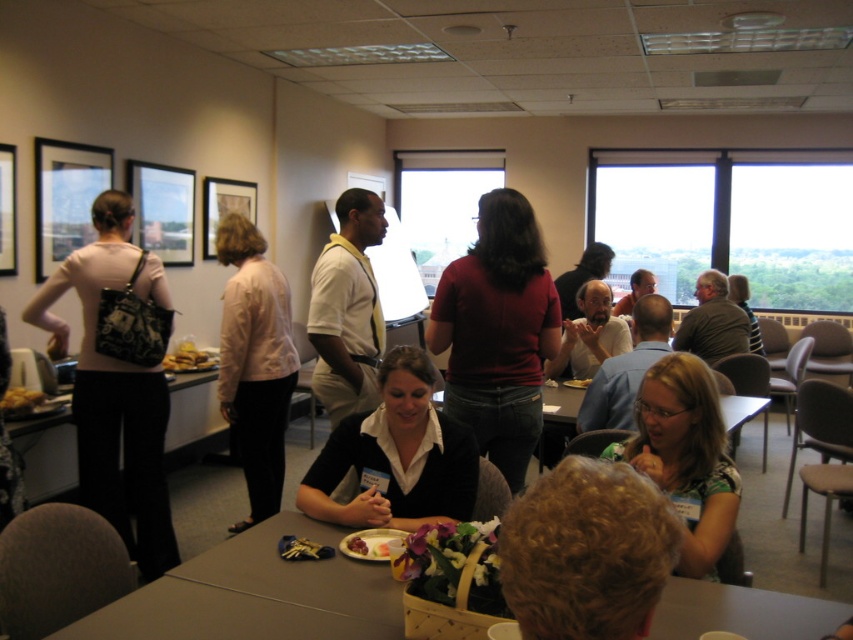
Question: Is light pink fabric shirt at center smaller than smooth white plate at center?

Choices:
 (A) yes
 (B) no

Answer: (B)

Question: Which object appears farthest from the camera in this image?

Choices:
 (A) smooth wooden table at center
 (B) matte black shirt at center

Answer: (B)

Question: Which of the following is the farthest from the observer?

Choices:
 (A) (20, 394)
 (B) (498, 371)
 (C) (169, 362)

Answer: (C)

Question: Which object is farther from the camera taking this photo?

Choices:
 (A) smooth wooden table at center
 (B) matte green shirt at center

Answer: (B)

Question: Observing the image, what is the correct spatial positioning of matte black shirt at center in reference to matte green shirt at center?

Choices:
 (A) left
 (B) right

Answer: (A)

Question: Can you confirm if matte black purse at left is thinner than smooth wooden table at center?

Choices:
 (A) no
 (B) yes

Answer: (A)